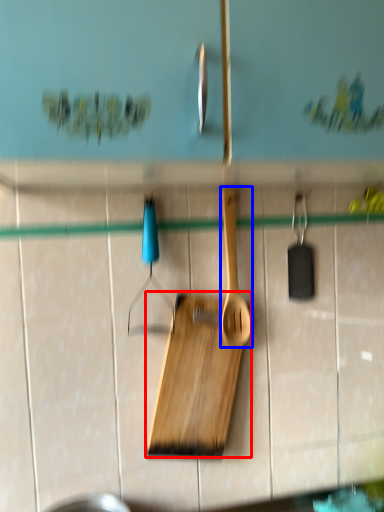
Question: Among these objects, which one is farthest to the camera, cutting board (highlighted by a red box) or spatula (highlighted by a blue box)?

Choices:
 (A) cutting board
 (B) spatula

Answer: (B)